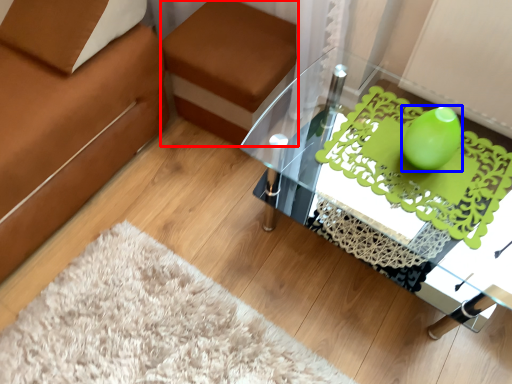
Question: Among these objects, which one is farthest to the camera, footrest (highlighted by a red box) or teal (highlighted by a blue box)?

Choices:
 (A) footrest
 (B) teal

Answer: (A)